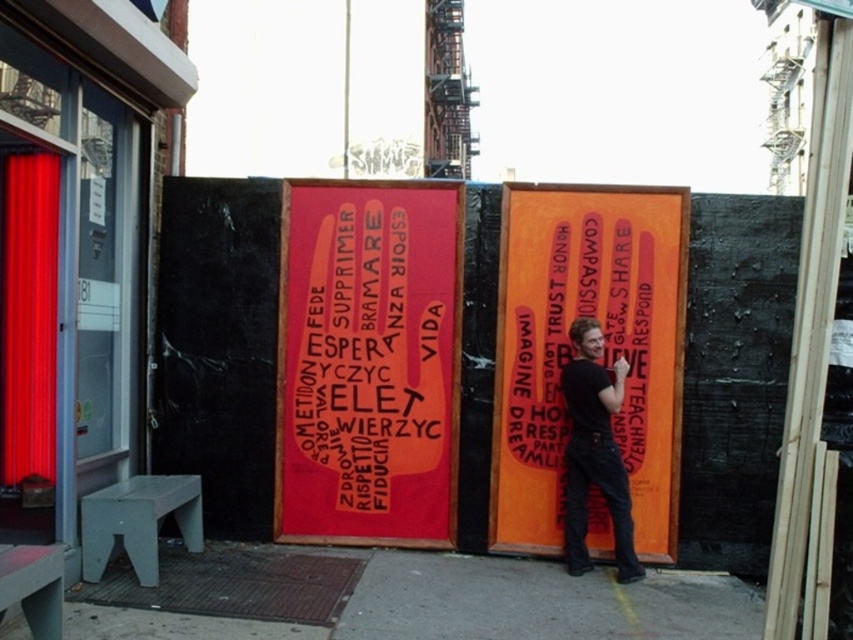
Who is more forward, (535, 417) or (337, 324)?

Positioned in front is point (535, 417).

Does orange matte sign at center appear on the right side of matte pink text at center?

Answer: Yes, orange matte sign at center is to the right of matte pink text at center.

Does point (631, 432) lie in front of point (292, 381)?

That is True.

I want to click on orange matte sign at center, so click(x=569, y=349).

Can you confirm if red glass door at left is positioned below matte pink text at center?

No.

Does red glass door at left have a larger size compared to matte pink text at center?

Yes.

Describe the element at coordinates (80, 244) in the screenshot. Image resolution: width=853 pixels, height=640 pixels. I see `red glass door at left` at that location.

You are a GUI agent. You are given a task and a screenshot of the screen. Output one action in this format:
    pyautogui.click(x=<x>, y=<y>)
    Task: Click on the red glass door at left
    
    Given the screenshot: What is the action you would take?
    (x=80, y=244)

Does red glass door at left have a greater width compared to denim jeans at center?

Correct, the width of red glass door at left exceeds that of denim jeans at center.

Who is positioned more to the left, red glass door at left or denim jeans at center?

red glass door at left

At what (x,y) coordinates should I click in order to perform the action: click on red glass door at left. Please return your answer as a coordinate pair (x, y). Looking at the image, I should click on (80, 244).